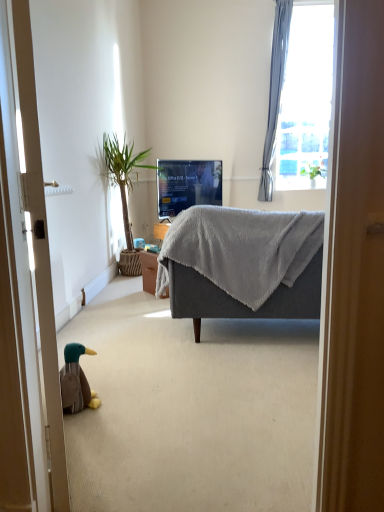
Find the location of a particular element. vacant space to the right of brown plush duck at lower left is located at coordinates (120, 399).